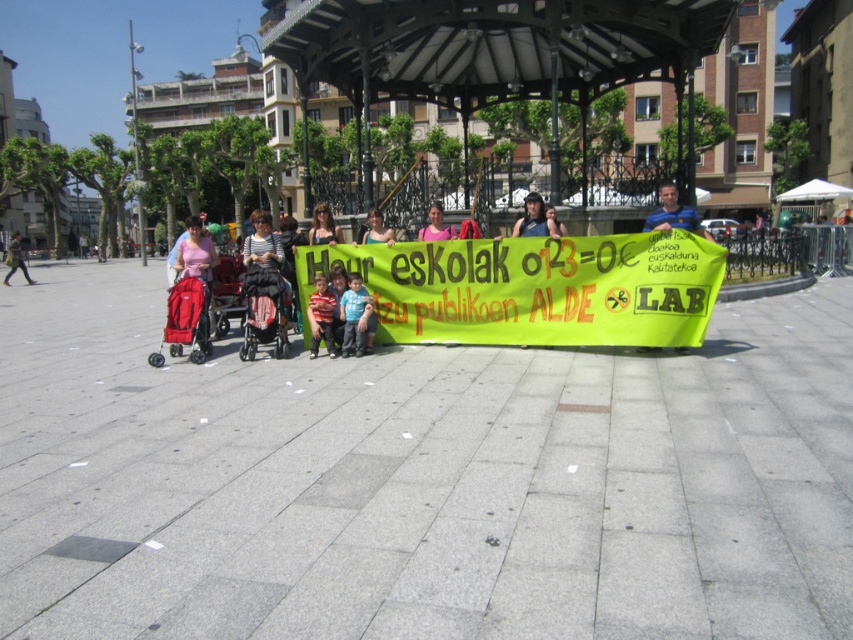
Question: Which of these objects is positioned farthest from the gray concrete pavement at center?

Choices:
 (A) green fabric shirt at center
 (B) black fabric stroller at center

Answer: (A)

Question: Is black fabric stroller at center below matte red stroller at left?

Choices:
 (A) no
 (B) yes

Answer: (A)

Question: Is dark blue shirt at center closer to camera compared to matte pink shirt at center?

Choices:
 (A) yes
 (B) no

Answer: (A)

Question: Estimate the real-world distances between objects in this image. Which object is farther from the black fabric stroller at center?

Choices:
 (A) striped shirt at center
 (B) matte black stroller at left

Answer: (B)

Question: In this image, where is green fabric banner at center located relative to striped shirt at center?

Choices:
 (A) left
 (B) right

Answer: (B)

Question: Which object appears farthest from the camera in this image?

Choices:
 (A) green fabric shirt at center
 (B) matte black stroller at left
 (C) striped shirt at center

Answer: (B)